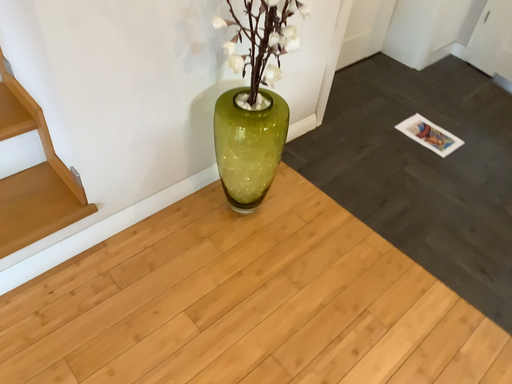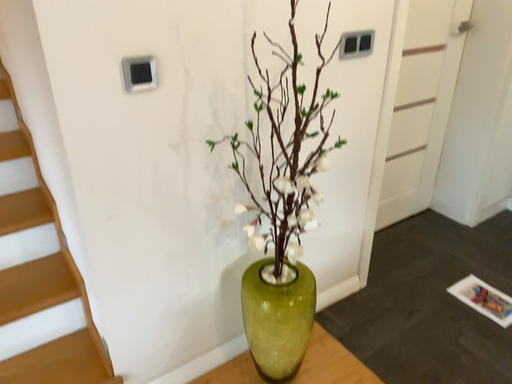
Question: Which way did the camera rotate in the video?

Choices:
 (A) rotated downward
 (B) rotated upward

Answer: (B)